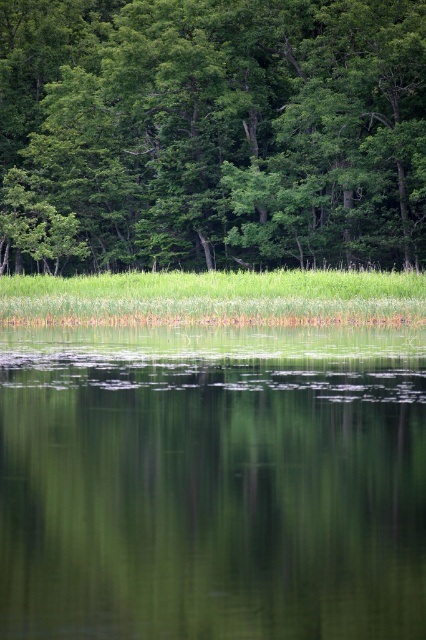
You are standing at the edge of the scene and want to look at both the green reflective water at center and the green leafy trees at upper center. Which object will appear taller to you?

The green leafy trees at upper center appear taller than the green reflective water at center because the water is not as tall as the trees.

Consider the image. You are standing on a path near the water and want to take a photo of the green leafy trees at upper center without the green reflective water at center appearing in the foreground. Is this possible?

The green reflective water at center is in front of the green leafy trees at upper center, so it will block the view. You cannot take a photo of the green leafy trees at upper center without the green reflective water at center appearing in the foreground.

Looking at this image, you are standing at the edge of the scene and want to reach the green reflective water at center. Which direction should you move to reach it?

Since the green reflective water at center is located at point 0.755 on the x axis and 0.498 on the y axis, you should move towards the center of the scene to reach it.